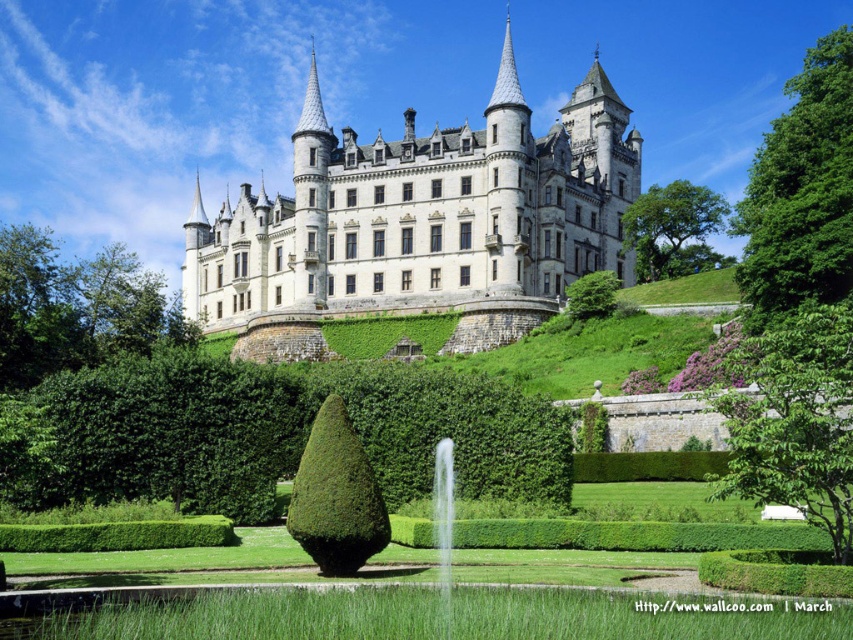
Question: Among these objects, which one is nearest to the camera?

Choices:
 (A) white stone castle at center
 (B) green leafy hedge at center

Answer: (B)

Question: Is white stone castle at center further to camera compared to green leafy hedge at center?

Choices:
 (A) yes
 (B) no

Answer: (A)

Question: Which point is farther to the camera?

Choices:
 (A) green leafy hedge at center
 (B) white stone castle at center

Answer: (B)

Question: Does white stone castle at center have a lesser width compared to green leafy hedge at center?

Choices:
 (A) yes
 (B) no

Answer: (B)

Question: Does white stone castle at center appear on the right side of green leafy hedge at center?

Choices:
 (A) yes
 (B) no

Answer: (A)